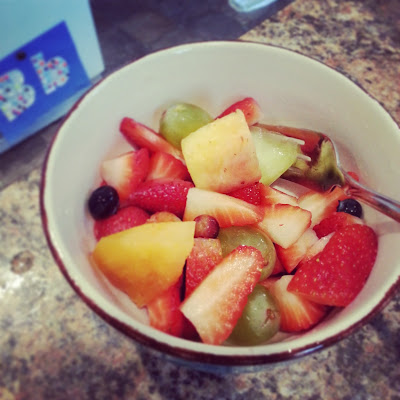
You are a GUI agent. You are given a task and a screenshot of the screen. Output one action in this format:
    pyautogui.click(x=<x>, y=<y>)
    Task: Click on the bowl
    Image resolution: width=400 pixels, height=400 pixels.
    Given the screenshot: What is the action you would take?
    pyautogui.click(x=262, y=351)